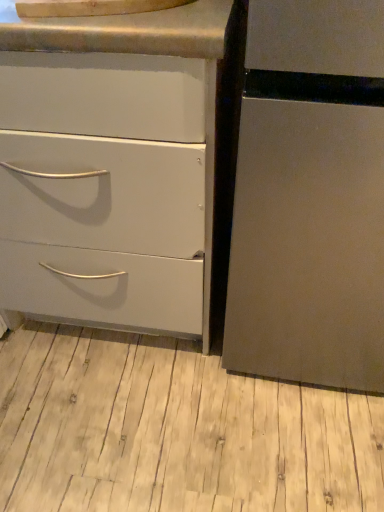
What do you see at coordinates (115, 168) in the screenshot? I see `matte white drawer at left` at bounding box center [115, 168].

At what (x,y) coordinates should I click in order to perform the action: click on matte white drawer at left. Please return your answer as a coordinate pair (x, y). Looking at the image, I should click on (115, 168).

Is brushed metal counter top at upper center bigger or smaller than matte white drawer at left?

A: brushed metal counter top at upper center is smaller than matte white drawer at left.

Considering the points (208, 7) and (203, 16), which point is behind, point (208, 7) or point (203, 16)?

The point (208, 7) is farther from the camera.

Would you consider brushed metal counter top at upper center to be distant from matte white drawer at left?

brushed metal counter top at upper center is actually quite close to matte white drawer at left.

Is brushed metal counter top at upper center wider or thinner than matte white drawer at left?

brushed metal counter top at upper center is thinner than matte white drawer at left.

Does point (40, 182) lie in front of point (154, 355)?

Yes, point (40, 182) is in front of point (154, 355).

Is matte white drawer at left positioned with its back to light wood floor at lower center?

matte white drawer at left is not turned away from light wood floor at lower center.

Which object is thinner, matte white drawer at left or light wood floor at lower center?

matte white drawer at left is thinner.

Is light wood floor at lower center taller than matte white drawer at left?

In fact, light wood floor at lower center may be shorter than matte white drawer at left.

Is light wood floor at lower center oriented away from matte white drawer at left?

No.

From a real-world perspective, is light wood floor at lower center physically above matte white drawer at left?

No.

From the image's perspective, which one is positioned higher, light wood floor at lower center or matte white drawer at left?

matte white drawer at left.

From the picture: Does brushed metal counter top at upper center turn towards light wood floor at lower center?

No, brushed metal counter top at upper center does not turn towards light wood floor at lower center.

How distant is brushed metal counter top at upper center from light wood floor at lower center?

A distance of 92.39 centimeters exists between brushed metal counter top at upper center and light wood floor at lower center.

Is brushed metal counter top at upper center positioned far away from light wood floor at lower center?

brushed metal counter top at upper center is near light wood floor at lower center, not far away.

Is brushed metal counter top at upper center in front of or behind light wood floor at lower center in the image?

Visually, brushed metal counter top at upper center is located in front of light wood floor at lower center.

The image size is (384, 512). Identify the location of chest of drawers on the left of brushed metal counter top at upper center. (115, 168).

Which of these two, matte white drawer at left or brushed metal counter top at upper center, is bigger?

matte white drawer at left.

Does matte white drawer at left turn towards brushed metal counter top at upper center?

No, matte white drawer at left does not turn towards brushed metal counter top at upper center.

Which is closer, (93, 211) or (99, 37)?

Point (99, 37)

Is light wood floor at lower center bigger than brushed metal counter top at upper center?

Yes, light wood floor at lower center is bigger than brushed metal counter top at upper center.

I want to click on counter top on the left of light wood floor at lower center, so click(128, 32).

Can you confirm if light wood floor at lower center is positioned to the left of brushed metal counter top at upper center?

In fact, light wood floor at lower center is to the right of brushed metal counter top at upper center.

Is light wood floor at lower center aimed at brushed metal counter top at upper center?

No, light wood floor at lower center is not aimed at brushed metal counter top at upper center.

You are a GUI agent. You are given a task and a screenshot of the screen. Output one action in this format:
    pyautogui.click(x=<x>, y=<y>)
    Task: Click on the chest of drawers lying on the left of brushed metal counter top at upper center
    
    Given the screenshot: What is the action you would take?
    pyautogui.click(x=115, y=168)

Locate an element on the screen. plank to the right of matte white drawer at left is located at coordinates (173, 431).

Estimate the real-world distances between objects in this image. Which object is further from light wood floor at lower center, brushed metal counter top at upper center or matte white drawer at left?

The object further to light wood floor at lower center is brushed metal counter top at upper center.

Looking at the image, which one is located closer to matte white drawer at left, light wood floor at lower center or brushed metal counter top at upper center?

brushed metal counter top at upper center is closer to matte white drawer at left.

Considering their positions, is matte white drawer at left positioned further to brushed metal counter top at upper center than light wood floor at lower center?

Based on the image, light wood floor at lower center appears to be further to brushed metal counter top at upper center.

Looking at the image, which one is located further to light wood floor at lower center, matte white drawer at left or brushed metal counter top at upper center?

brushed metal counter top at upper center lies further to light wood floor at lower center than the other object.

From the image, which object appears to be farther from brushed metal counter top at upper center, light wood floor at lower center or matte white drawer at left?

The object further to brushed metal counter top at upper center is light wood floor at lower center.

When comparing their distances from matte white drawer at left, does brushed metal counter top at upper center or light wood floor at lower center seem closer?

The object closer to matte white drawer at left is brushed metal counter top at upper center.

Identify the location of the chest of drawers between brushed metal counter top at upper center and light wood floor at lower center vertically. (115, 168).